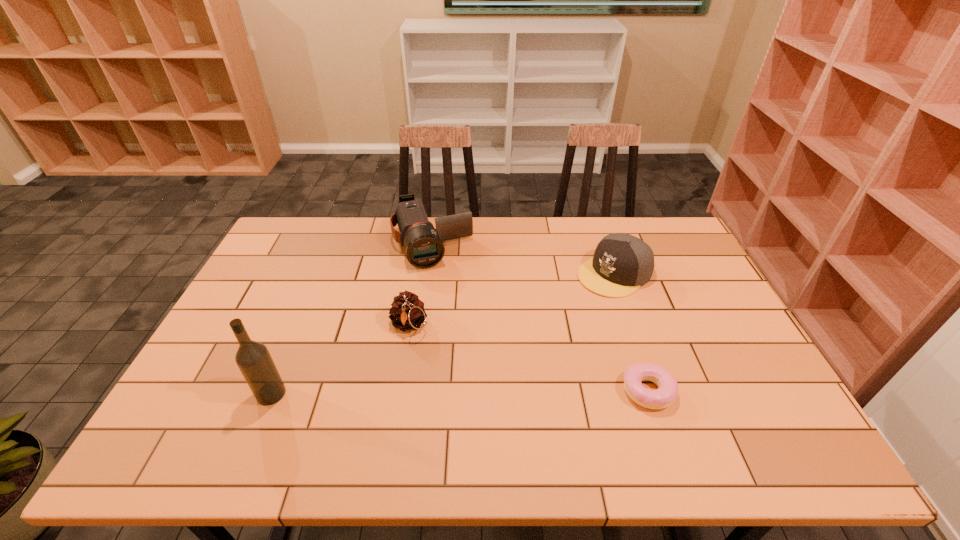
Locate an element on the screen. This screenshot has height=540, width=960. doughnut located at the near edge is located at coordinates (664, 396).

You are a GUI agent. You are given a task and a screenshot of the screen. Output one action in this format:
    pyautogui.click(x=<x>, y=<y>)
    Task: Click on the free location at the far edge
    The height and width of the screenshot is (540, 960).
    Given the screenshot: What is the action you would take?
    pyautogui.click(x=368, y=237)

Find the location of a particular element. The height and width of the screenshot is (540, 960). free space at the near edge of the desktop is located at coordinates (323, 420).

The image size is (960, 540). I want to click on vacant space at the left edge of the desktop, so click(x=262, y=263).

This screenshot has height=540, width=960. In order to click on free point between the third nearest object and the cap in this screenshot , I will do `click(512, 299)`.

This screenshot has height=540, width=960. I want to click on free space between the shortest object and the camcorder, so click(540, 317).

The height and width of the screenshot is (540, 960). In order to click on vacant area between the leftmost object and the cap in this screenshot , I will do `click(443, 334)`.

Where is `empty location between the vodka and the shortest object`? The height and width of the screenshot is (540, 960). empty location between the vodka and the shortest object is located at coordinates (460, 393).

Where is `free area in between the camcorder and the cap`? The width and height of the screenshot is (960, 540). free area in between the camcorder and the cap is located at coordinates (523, 258).

Locate an element on the screen. The image size is (960, 540). vacant region between the cap and the camcorder is located at coordinates (523, 258).